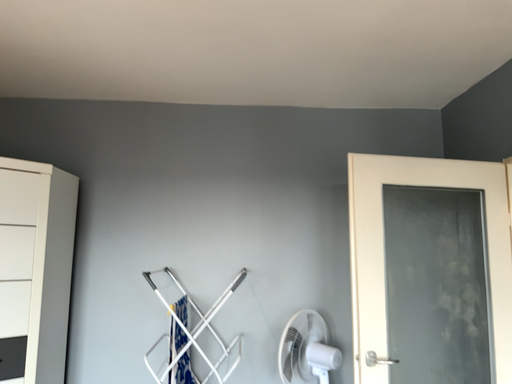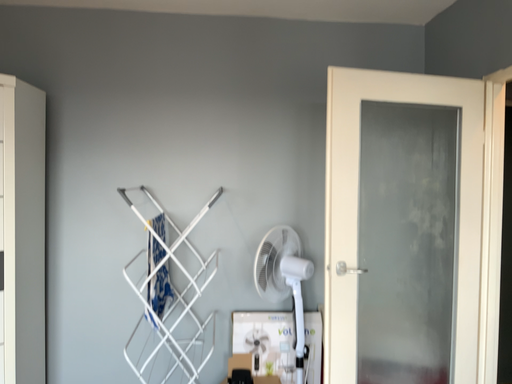
Question: How did the camera likely rotate when shooting the video?

Choices:
 (A) rotated upward
 (B) rotated downward

Answer: (B)